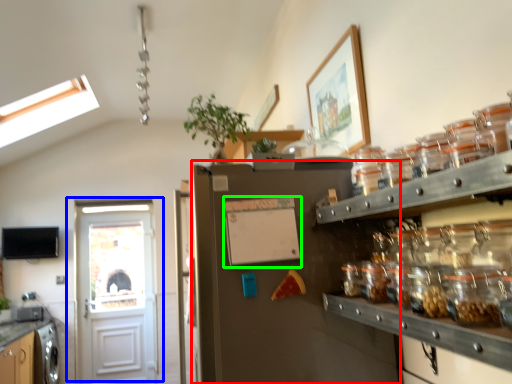
Question: Which is nearer to the fridge (highlighted by a red box)? door (highlighted by a blue box) or bulletin board (highlighted by a green box).

Choices:
 (A) door
 (B) bulletin board

Answer: (B)